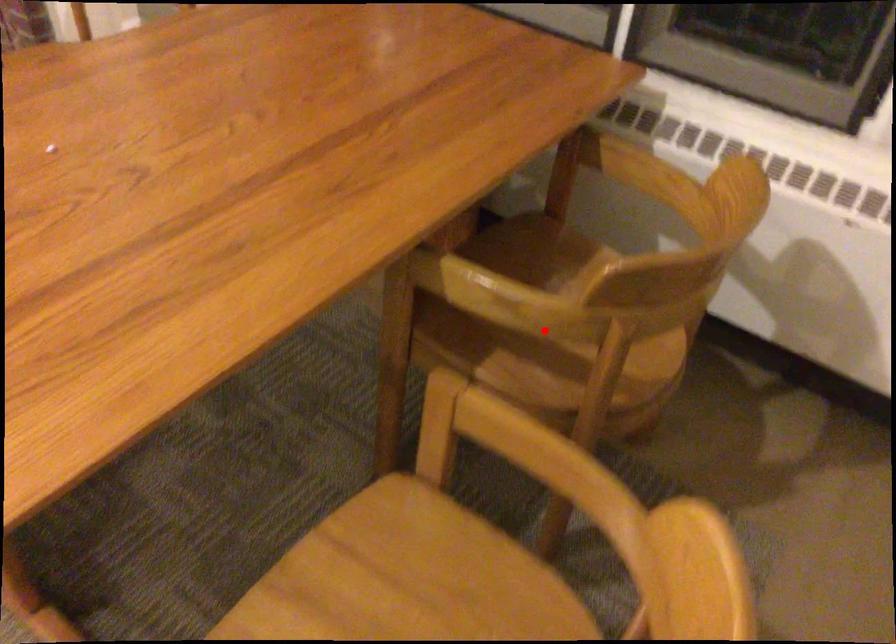
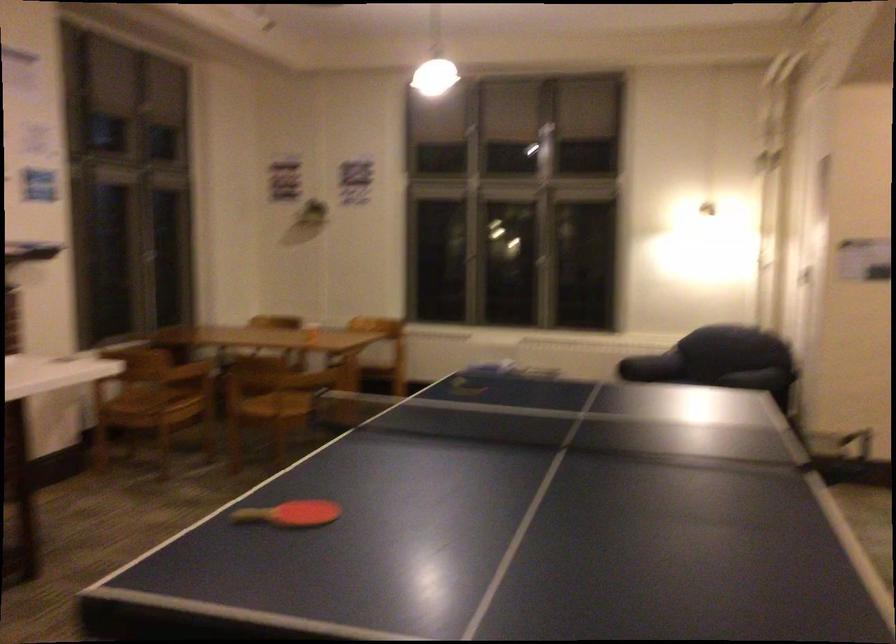
Question: I am providing you with two images of the same scene from different viewpoints. A red point is marked on the first image. Is the red point's position out of view in image 2?

Choices:
 (A) Yes
 (B) No

Answer: (A)